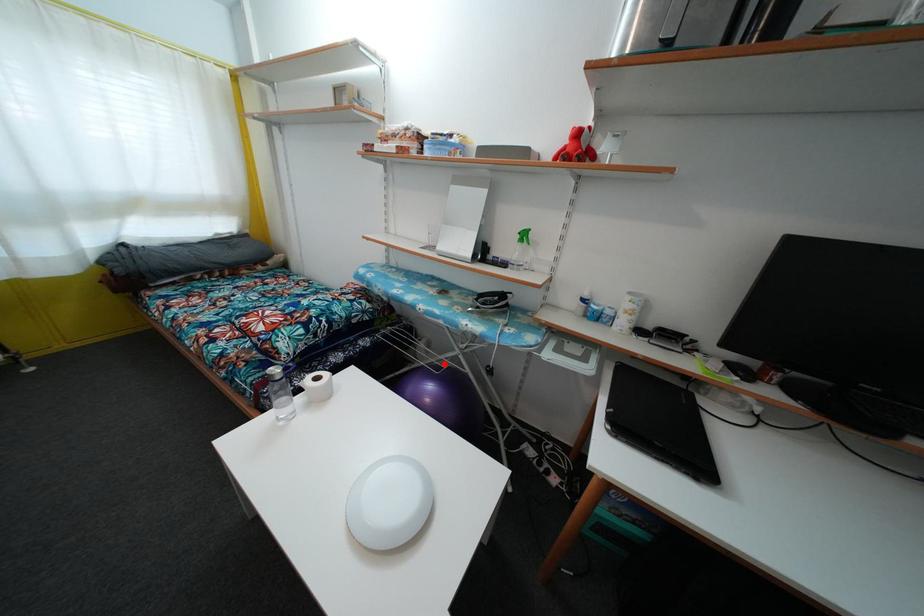
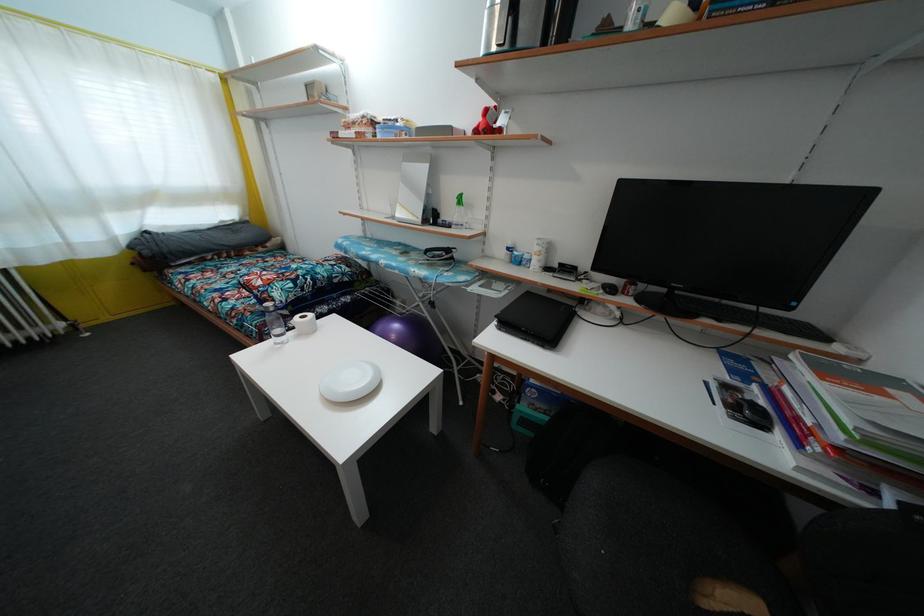
The point at the highlighted location is marked in the first image. Where is the corresponding point in the second image?

(411, 315)